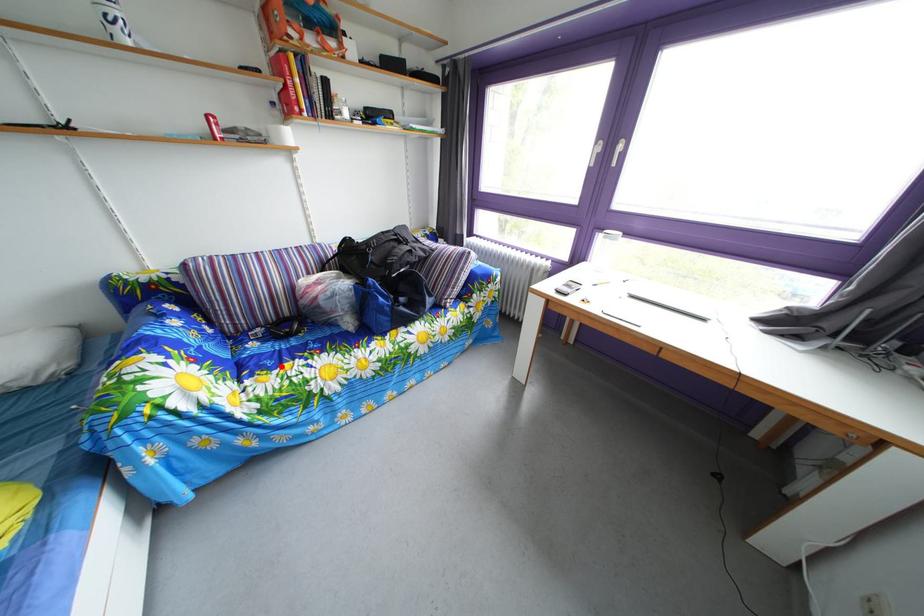
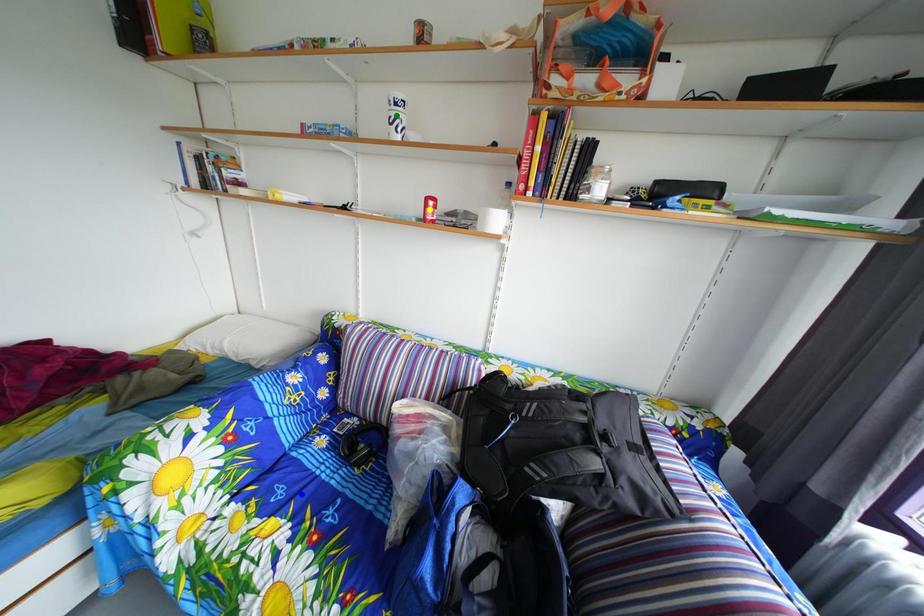
Question: I am providing you with two images of the same scene from different viewpoints. A red point is marked on the first image. You are given multiple points on the second image. Which point in image 2 is actually the same real-world point as the red point in image 1?

Choices:
 (A) green point
 (B) yellow point
 (C) blue point

Answer: (C)